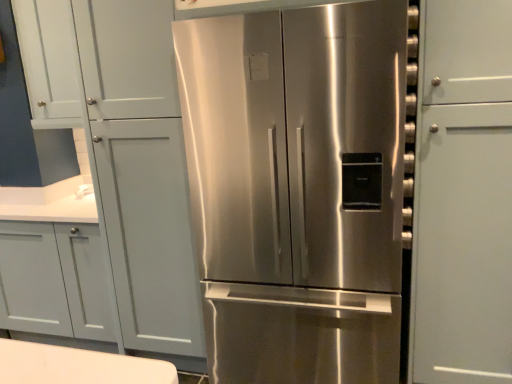
This screenshot has height=384, width=512. In order to click on white matte cabinet doors at upper left in this screenshot , I will do `click(49, 62)`.

Describe the element at coordinates (49, 62) in the screenshot. I see `white matte cabinet doors at upper left` at that location.

What is the approximate width of stainless steel refrigerator at center?

29.33 inches.

Where is `stainless steel refrigerator at center`? The height and width of the screenshot is (384, 512). stainless steel refrigerator at center is located at coordinates (298, 189).

Describe the element at coordinates (298, 189) in the screenshot. I see `stainless steel refrigerator at center` at that location.

Find the location of a particular element. This screenshot has width=512, height=384. white matte cabinet doors at upper left is located at coordinates (49, 62).

Which object is positioned more to the left, white matte cabinet doors at upper left or stainless steel refrigerator at center?

white matte cabinet doors at upper left is more to the left.

Is the position of white matte cabinet doors at upper left more distant than that of stainless steel refrigerator at center?

Yes.

Is point (38, 112) closer or farther from the camera than point (225, 278)?

Point (38, 112) appears to be farther away from the viewer than point (225, 278).

From the image's perspective, would you say white matte cabinet doors at upper left is shown under stainless steel refrigerator at center?

Actually, white matte cabinet doors at upper left appears above stainless steel refrigerator at center in the image.

From a real-world perspective, is white matte cabinet doors at upper left positioned over stainless steel refrigerator at center based on gravity?

Yes, from a real-world perspective, white matte cabinet doors at upper left is above stainless steel refrigerator at center.

Can you confirm if white matte cabinet doors at upper left is thinner than stainless steel refrigerator at center?

Yes.

Between white matte cabinet doors at upper left and stainless steel refrigerator at center, which one has less height?

With less height is white matte cabinet doors at upper left.

Which of these two, white matte cabinet doors at upper left or stainless steel refrigerator at center, is bigger?

stainless steel refrigerator at center is bigger.

Is white matte cabinet doors at upper left completely or partially outside of stainless steel refrigerator at center?

Absolutely, white matte cabinet doors at upper left is external to stainless steel refrigerator at center.

Would you say white matte cabinet doors at upper left is a long distance from stainless steel refrigerator at center?

Absolutely, white matte cabinet doors at upper left is distant from stainless steel refrigerator at center.

Is stainless steel refrigerator at center at the back of white matte cabinet doors at upper left?

white matte cabinet doors at upper left is not turned away from stainless steel refrigerator at center.

The width and height of the screenshot is (512, 384). What are the coordinates of `door behind the stainless steel refrigerator at center` in the screenshot? It's located at (49, 62).

Which is more to the left, stainless steel refrigerator at center or white matte cabinet doors at upper left?

white matte cabinet doors at upper left is more to the left.

Considering the positions of objects stainless steel refrigerator at center and white matte cabinet doors at upper left in the image provided, who is behind, stainless steel refrigerator at center or white matte cabinet doors at upper left?

white matte cabinet doors at upper left is further away from the camera.

Does point (342, 320) appear closer or farther from the camera than point (45, 25)?

Clearly, point (342, 320) is closer to the camera than point (45, 25).

From the image's perspective, relative to white matte cabinet doors at upper left, is stainless steel refrigerator at center above or below?

Based on their image positions, stainless steel refrigerator at center is located beneath white matte cabinet doors at upper left.

From a real-world perspective, is stainless steel refrigerator at center physically located above or below white matte cabinet doors at upper left?

stainless steel refrigerator at center is situated lower than white matte cabinet doors at upper left in the real world.

Which of these two, stainless steel refrigerator at center or white matte cabinet doors at upper left, is thinner?

white matte cabinet doors at upper left.

Is stainless steel refrigerator at center taller or shorter than white matte cabinet doors at upper left?

Considering their sizes, stainless steel refrigerator at center has more height than white matte cabinet doors at upper left.

Which of these two, stainless steel refrigerator at center or white matte cabinet doors at upper left, is bigger?

Bigger between the two is stainless steel refrigerator at center.

Is stainless steel refrigerator at center surrounding white matte cabinet doors at upper left?

Definitely not — white matte cabinet doors at upper left is not inside stainless steel refrigerator at center.

Are stainless steel refrigerator at center and white matte cabinet doors at upper left far apart?

Yes.

Is stainless steel refrigerator at center oriented towards white matte cabinet doors at upper left?

No.

Identify the location of refrigerator lying on the right of white matte cabinet doors at upper left. (298, 189).

Where is `door that appears on the left of stainless steel refrigerator at center`? door that appears on the left of stainless steel refrigerator at center is located at coordinates (49, 62).

Find the location of a particular element. This screenshot has height=384, width=512. door behind the stainless steel refrigerator at center is located at coordinates (49, 62).